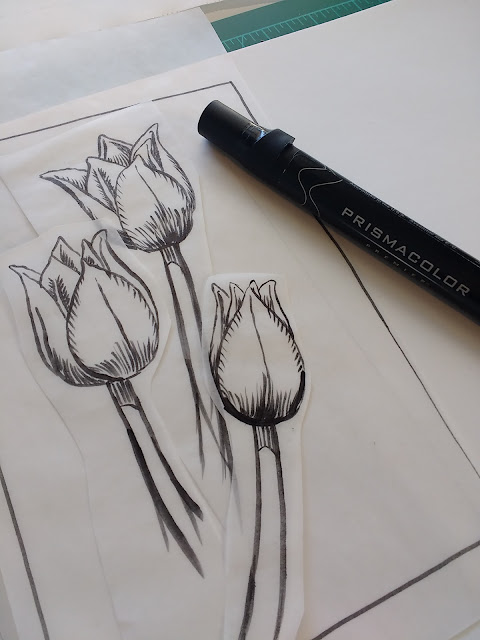
Where is `marker`? The height and width of the screenshot is (640, 480). marker is located at coordinates (372, 214).